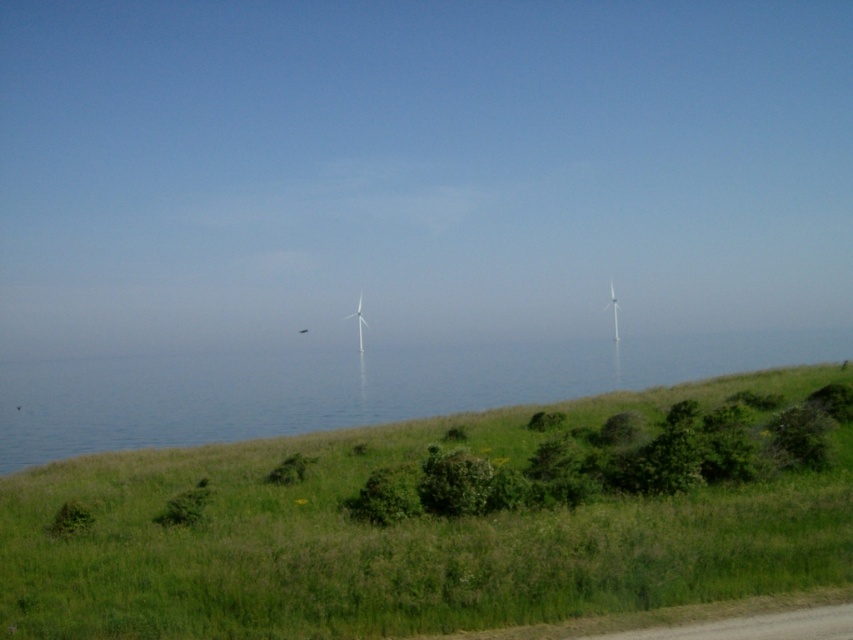
Who is positioned more to the left, white matte wind turbine at center or white plastic wind turbine at center?

white matte wind turbine at center is more to the left.

Which is in front, point (363, 346) or point (614, 300)?

Positioned in front is point (363, 346).

The width and height of the screenshot is (853, 640). In order to click on white matte wind turbine at center in this screenshot , I will do `click(358, 323)`.

Is blue water at center thinner than white plastic wind turbine at center?

No.

In order to click on blue water at center in this screenshot , I will do `click(347, 387)`.

Does green grassy hillside at lower center lie in front of blue water at center?

That is True.

Does point (363, 524) come in front of point (422, 372)?

Yes, point (363, 524) is in front of point (422, 372).

Is point (448, 621) positioned behind point (468, 348)?

No, it is in front of (468, 348).

Where is `green grassy hillside at lower center`? The height and width of the screenshot is (640, 853). green grassy hillside at lower center is located at coordinates (427, 525).